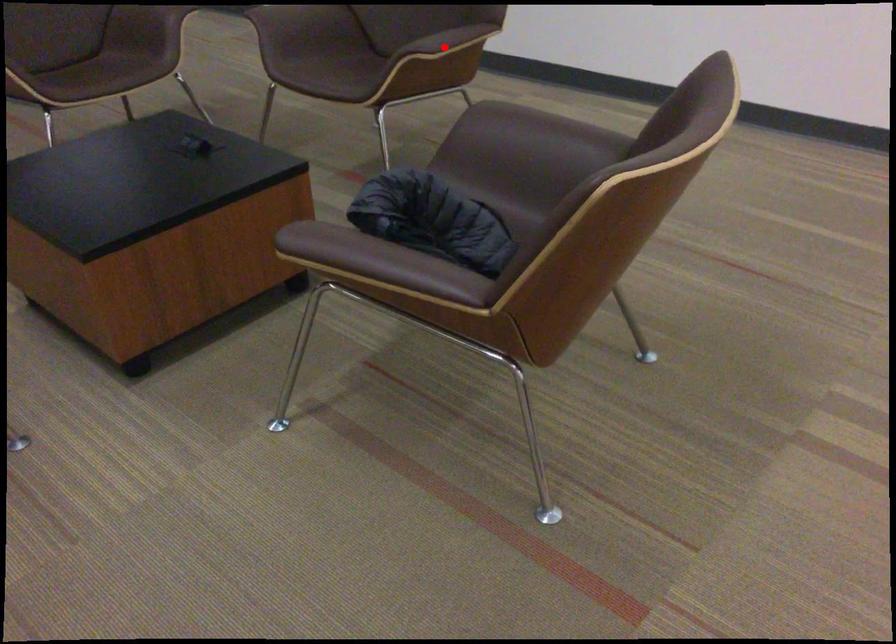
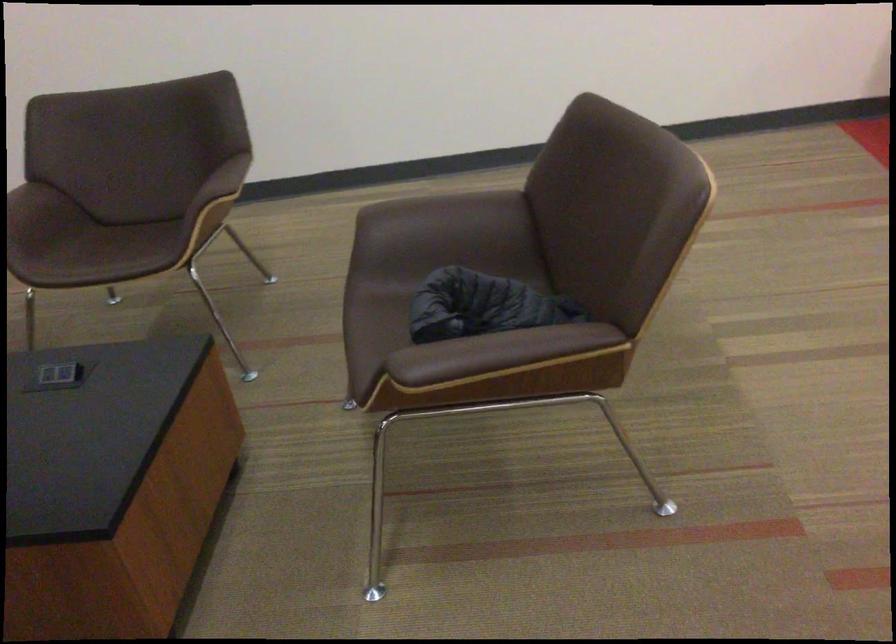
Question: I am providing you with two images of the same scene from different viewpoints. A red point is marked on the first image. Can you still see the location of the red point in image 2?

Choices:
 (A) Yes
 (B) No

Answer: (B)